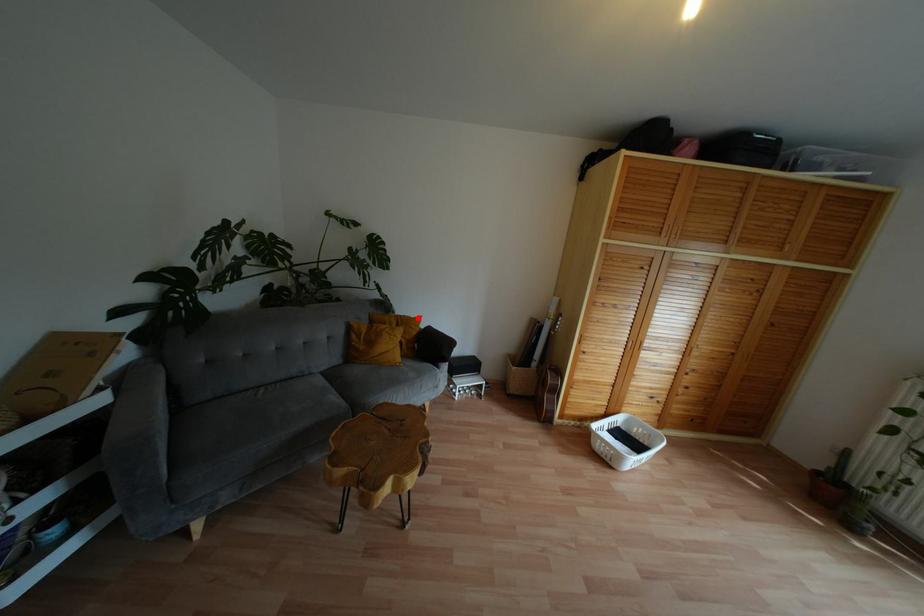
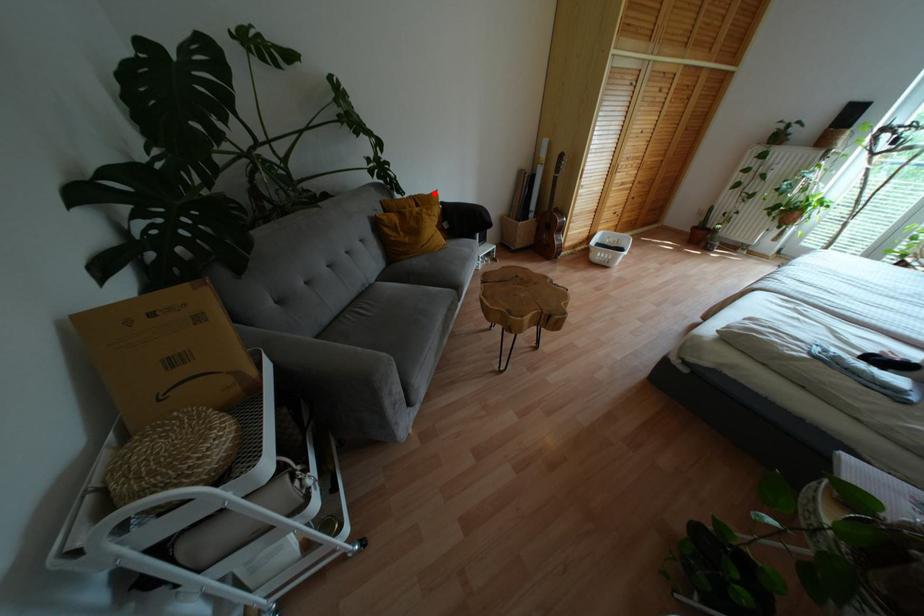
I am providing you with two images of the same scene from different viewpoints. A red point is marked on the first image and another point is marked on the second image. Are the points marked in image1 and image2 representing the same 3D position?

Yes